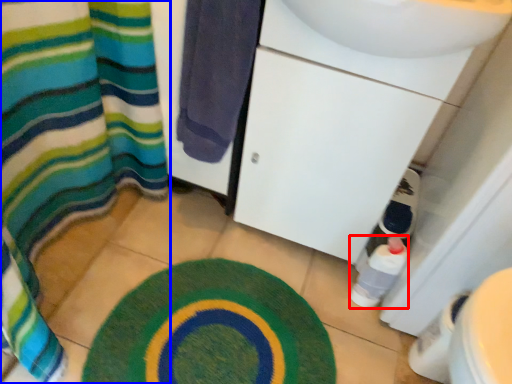
Question: Which of the following is the closest to the observer, bottle (highlighted by a red box) or curtain (highlighted by a blue box)?

Choices:
 (A) bottle
 (B) curtain

Answer: (A)